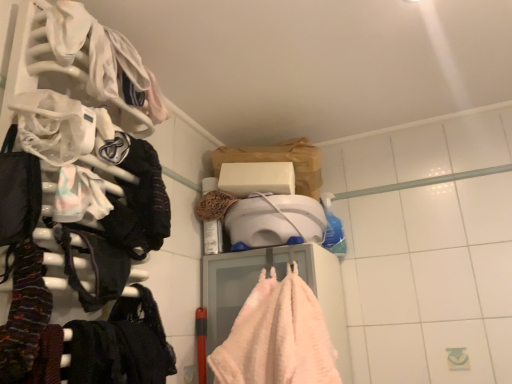
How much space does pastel cotton bib at left, which appears as the first clothing when viewed from the top, occupy horizontally?

The width of pastel cotton bib at left, which appears as the first clothing when viewed from the top, is 3.00 inches.

Locate an element on the screen. Image resolution: width=512 pixels, height=384 pixels. pastel cotton bib at left, which ranks as the 1th clothing in back-to-front order is located at coordinates (79, 195).

Does knitted wool scarf at left, marked as the 2th clothing in a top-to-bottom arrangement, have a lesser height compared to white plastic hanger at left?

Yes.

Considering the points (2, 358) and (158, 381), which point is in front, point (2, 358) or point (158, 381)?

Point (2, 358)

Is knitted wool scarf at left, the 2th clothing viewed from the back, inside the boundaries of white plastic hanger at left, or outside?

knitted wool scarf at left, the 2th clothing viewed from the back, is located inside white plastic hanger at left.

Where is `closet lying above the pastel cotton bib at left, which ranks as the second clothing in front-to-back order (from the image's perspective)`? closet lying above the pastel cotton bib at left, which ranks as the second clothing in front-to-back order (from the image's perspective) is located at coordinates (90, 158).

Are pastel cotton bib at left, which ranks as the second clothing in front-to-back order, and white plastic hanger at left making contact?

pastel cotton bib at left, which ranks as the second clothing in front-to-back order, and white plastic hanger at left are not in contact.

Between pastel cotton bib at left, the second clothing from the bottom, and white plastic hanger at left, which one has larger width?

white plastic hanger at left is wider.

Which is correct: pastel cotton bib at left, the second clothing from the bottom, is inside white plastic hanger at left, or outside of it?

pastel cotton bib at left, the second clothing from the bottom, cannot be found inside white plastic hanger at left.

From a real-world perspective, who is located lower, white plastic hanger at left or knitted wool scarf at left, which ranks as the first clothing in bottom-to-top order?

knitted wool scarf at left, which ranks as the first clothing in bottom-to-top order, from a real-world perspective.

Is white plastic hanger at left not inside knitted wool scarf at left, which ranks as the first clothing in bottom-to-top order?

Yes, white plastic hanger at left is not within knitted wool scarf at left, which ranks as the first clothing in bottom-to-top order.

Is white plastic hanger at left oriented towards knitted wool scarf at left, which ranks as the first clothing in bottom-to-top order?

Yes.

Does point (91, 122) come behind point (24, 299)?

Yes, it is behind point (24, 299).

From a real-world perspective, who is located lower, knitted wool scarf at left, the 2th clothing viewed from the back, or pastel cotton bib at left, which appears as the first clothing when viewed from the top?

knitted wool scarf at left, the 2th clothing viewed from the back, is physically lower.

Would you say knitted wool scarf at left, the 2th clothing viewed from the back, is to the left or to the right of pastel cotton bib at left, the second clothing from the bottom, in the picture?

From the image, it's evident that knitted wool scarf at left, the 2th clothing viewed from the back, is to the left of pastel cotton bib at left, the second clothing from the bottom.

From the image's perspective, is knitted wool scarf at left, marked as the 2th clothing in a top-to-bottom arrangement, below pastel cotton bib at left, which appears as the first clothing when viewed from the top?

Yes, from the image's perspective, knitted wool scarf at left, marked as the 2th clothing in a top-to-bottom arrangement, is below pastel cotton bib at left, which appears as the first clothing when viewed from the top.

Is knitted wool scarf at left, which ranks as the first clothing in bottom-to-top order, next to pastel cotton bib at left, the second clothing from the bottom?

knitted wool scarf at left, which ranks as the first clothing in bottom-to-top order, and pastel cotton bib at left, the second clothing from the bottom, are clearly separated.

Between pastel cotton bib at left, the second clothing from the bottom, and knitted wool scarf at left, arranged as the first clothing when viewed from the front, which one is positioned behind?

pastel cotton bib at left, the second clothing from the bottom, is further from the camera.

At what (x,y) coordinates should I click in order to perform the action: click on clothing that appears on the left of pastel cotton bib at left, the second clothing from the bottom. Please return your answer as a coordinate pair (x, y). Looking at the image, I should click on (24, 315).

Looking at this image, who is shorter, pastel cotton bib at left, the second clothing from the bottom, or knitted wool scarf at left, arranged as the first clothing when viewed from the front?

With less height is pastel cotton bib at left, the second clothing from the bottom.

Is white plastic hanger at left positioned far away from pastel cotton bib at left, the second clothing from the bottom?

No, white plastic hanger at left is not far from pastel cotton bib at left, the second clothing from the bottom.

Is white plastic hanger at left aimed at pastel cotton bib at left, which ranks as the second clothing in front-to-back order?

Yes, white plastic hanger at left faces towards pastel cotton bib at left, which ranks as the second clothing in front-to-back order.

Is pastel cotton bib at left, the second clothing from the bottom, inside white plastic hanger at left?

No, pastel cotton bib at left, the second clothing from the bottom, is not surrounded by white plastic hanger at left.

Locate an element on the screen. Image resolution: width=512 pixels, height=384 pixels. closet above the knitted wool scarf at left, which ranks as the first clothing in bottom-to-top order (from a real-world perspective) is located at coordinates (90, 158).

Where is `closet above the pastel cotton bib at left, which ranks as the second clothing in front-to-back order (from the image's perspective)`? closet above the pastel cotton bib at left, which ranks as the second clothing in front-to-back order (from the image's perspective) is located at coordinates (90, 158).

From the image, which object appears to be nearer to white plastic hanger at left, pastel cotton bib at left, which appears as the first clothing when viewed from the top, or knitted wool scarf at left, the 2th clothing viewed from the back?

pastel cotton bib at left, which appears as the first clothing when viewed from the top.

From the image, which object appears to be farther from pastel cotton bib at left, which ranks as the 1th clothing in back-to-front order, white plastic hanger at left or knitted wool scarf at left, which ranks as the first clothing in bottom-to-top order?

knitted wool scarf at left, which ranks as the first clothing in bottom-to-top order, lies further to pastel cotton bib at left, which ranks as the 1th clothing in back-to-front order, than the other object.

Considering their positions, is white plastic hanger at left positioned closer to knitted wool scarf at left, which ranks as the first clothing in bottom-to-top order, than pastel cotton bib at left, the second clothing from the bottom?

Based on the image, pastel cotton bib at left, the second clothing from the bottom, appears to be nearer to knitted wool scarf at left, which ranks as the first clothing in bottom-to-top order.

From the image, which object appears to be farther from knitted wool scarf at left, marked as the 2th clothing in a top-to-bottom arrangement, pastel cotton bib at left, which appears as the first clothing when viewed from the top, or white plastic hanger at left?

white plastic hanger at left is positioned further to the anchor knitted wool scarf at left, marked as the 2th clothing in a top-to-bottom arrangement.

From the image, which object appears to be farther from white plastic hanger at left, knitted wool scarf at left, arranged as the first clothing when viewed from the front, or pastel cotton bib at left, which ranks as the second clothing in front-to-back order?

knitted wool scarf at left, arranged as the first clothing when viewed from the front, lies further to white plastic hanger at left than the other object.

Considering their positions, is knitted wool scarf at left, marked as the 2th clothing in a top-to-bottom arrangement, positioned further to pastel cotton bib at left, which ranks as the 1th clothing in back-to-front order, than white plastic hanger at left?

The object further to pastel cotton bib at left, which ranks as the 1th clothing in back-to-front order, is knitted wool scarf at left, marked as the 2th clothing in a top-to-bottom arrangement.

Identify the location of clothing between white plastic hanger at left and knitted wool scarf at left, arranged as the first clothing when viewed from the front, vertically. (79, 195).